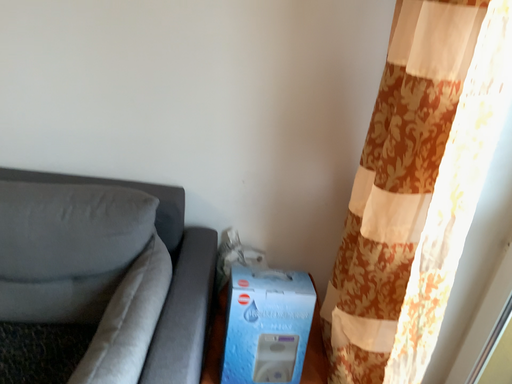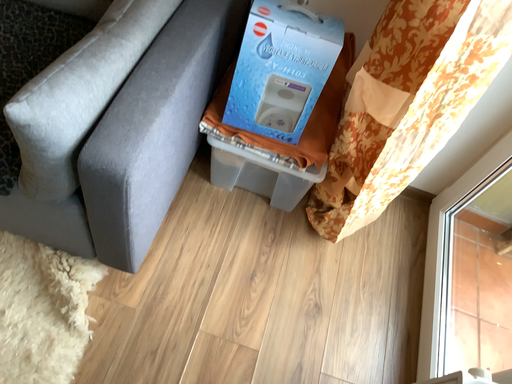
Question: How did the camera likely rotate when shooting the video?

Choices:
 (A) rotated upward
 (B) rotated downward

Answer: (B)